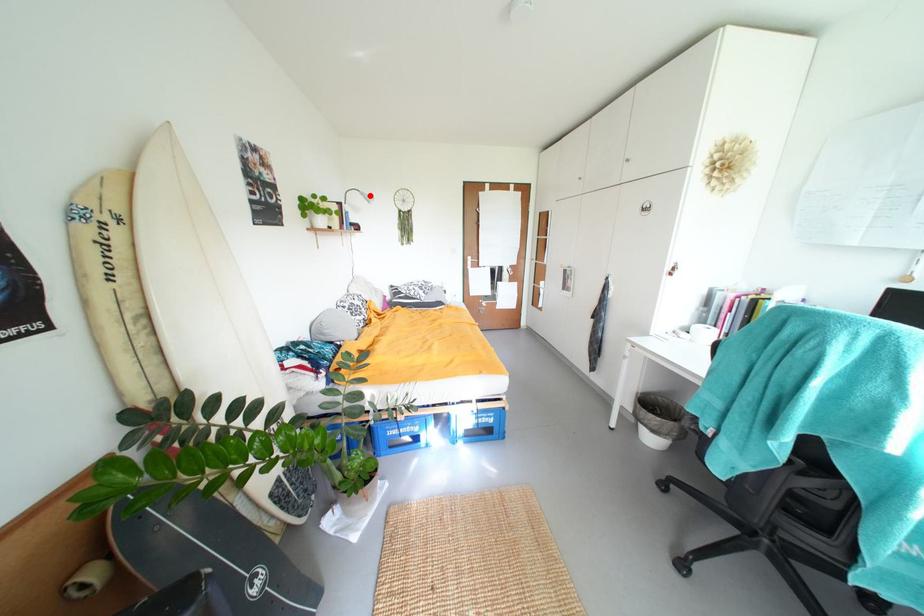
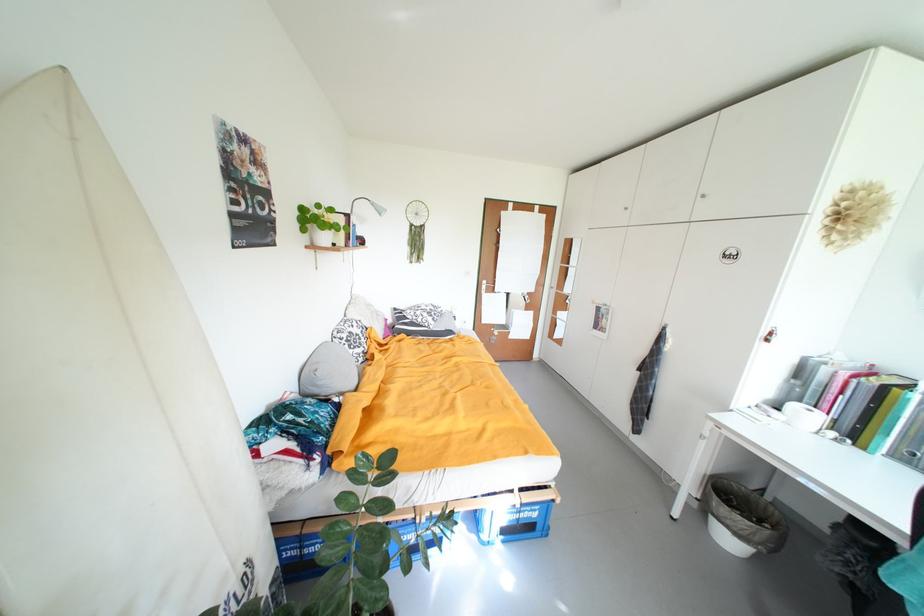
Find the pixel in the second image that matches the highlighted location in the first image.

(381, 206)